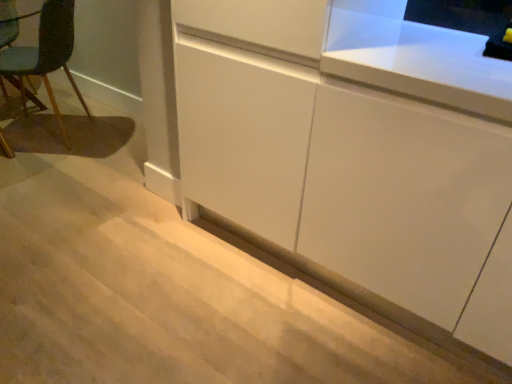
Where is `free location to the left of white matte cabinet at center, which is counted as the 2th cabinetry, starting from the left`? free location to the left of white matte cabinet at center, which is counted as the 2th cabinetry, starting from the left is located at coordinates (248, 320).